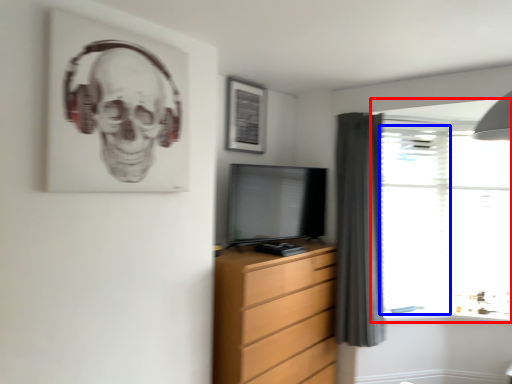
Question: Which object appears closest to the camera in this image, window (highlighted by a red box) or glass door (highlighted by a blue box)?

Choices:
 (A) window
 (B) glass door

Answer: (A)